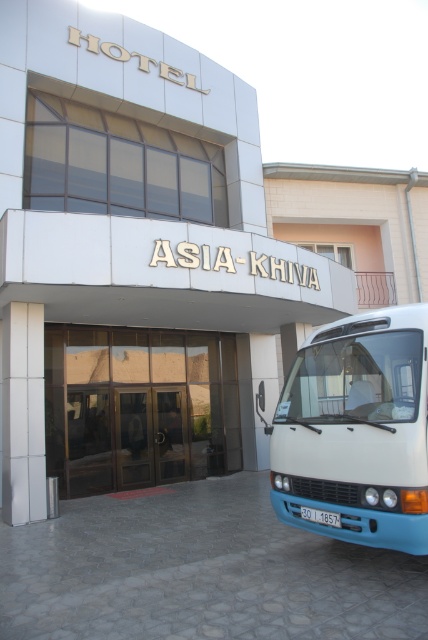
Can you confirm if white glossy van at right is taller than shiny glass doors at center?

No, white glossy van at right is not taller than shiny glass doors at center.

Does white glossy van at right appear over shiny glass doors at center?

Yes.

Is point (299, 474) closer to camera compared to point (83, 336)?

Yes, it is in front of point (83, 336).

The width and height of the screenshot is (428, 640). In order to click on white glossy van at right in this screenshot , I will do `click(356, 432)`.